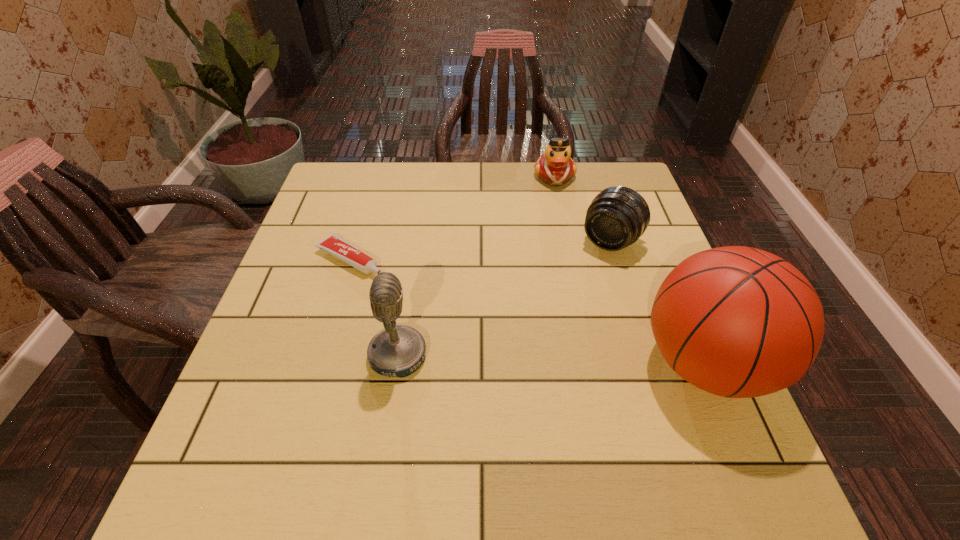
Identify the location of free space located at the nozzle of the toothpaste. The height and width of the screenshot is (540, 960). (495, 343).

Locate an element on the screen. This screenshot has height=540, width=960. vacant space located at the nozzle of the toothpaste is located at coordinates (499, 346).

At what (x,y) coordinates should I click in order to perform the action: click on vacant space located 0.220m at the front element of the telephoto lens. Please return your answer as a coordinate pair (x, y). This screenshot has width=960, height=540. Looking at the image, I should click on coord(557,314).

You are a GUI agent. You are given a task and a screenshot of the screen. Output one action in this format:
    pyautogui.click(x=<x>, y=<y>)
    Task: Click on the vacant area located 0.160m at the front element of the telephoto lens
    This screenshot has height=540, width=960.
    Given the screenshot: What is the action you would take?
    pyautogui.click(x=568, y=298)

This screenshot has height=540, width=960. I want to click on vacant space located at the front element of the telephoto lens, so click(x=580, y=282).

Locate an element on the screen. This screenshot has height=540, width=960. vacant space positioned 0.280m on the face of the farthest object is located at coordinates (571, 253).

Find the location of a particular element. The width and height of the screenshot is (960, 540). vacant region located 0.180m on the face of the farthest object is located at coordinates (565, 228).

You are a GUI agent. You are given a task and a screenshot of the screen. Output one action in this format:
    pyautogui.click(x=<x>, y=<y>)
    Task: Click on the vacant space located on the face of the farthest object
    Image resolution: width=960 pixels, height=540 pixels.
    Given the screenshot: What is the action you would take?
    pyautogui.click(x=569, y=246)

This screenshot has height=540, width=960. I want to click on object that is at the far edge, so click(555, 167).

This screenshot has height=540, width=960. I want to click on object that is at the near edge, so click(739, 322).